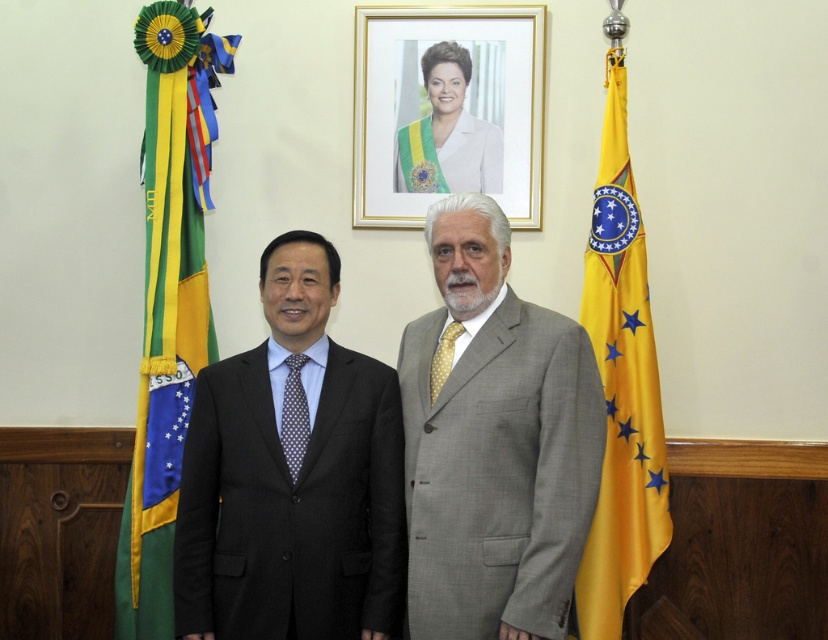
You are standing in a government office and see the black pinstripe suit at center. If you want to reach it without moving your feet, can you do so with your arm?

The black pinstripe suit at center is 2.24 meters away from viewer, so no, you cannot reach it with your arm since the average human arm length is about 0.7 meters.

You are a photographer asked to take a photo of the black suit at center and the yellow fabric flag at right. The client wants to ensure the flag is visible above the person. Can you confirm if the current arrangement allows this?

The black suit at center is below the yellow fabric flag at right, so the flag is already positioned above the person, meeting the client requirement.

You are a photographer adjusting your camera to capture the two men in the scene. You notice the black pinstripe suit at center and the polka dot silk tie at center. Which object is positioned lower in the image?

The black pinstripe suit at center is located below the polka dot silk tie at center, so the black pinstripe suit at center is positioned lower in the image.